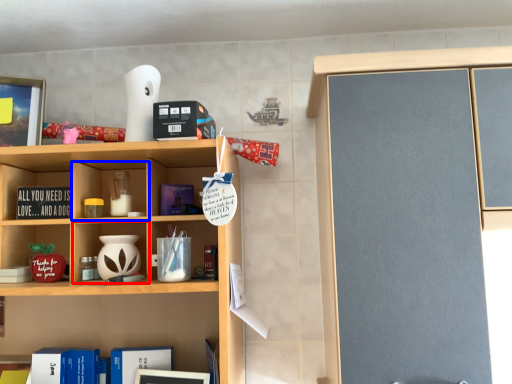
Question: Which object is further to the camera taking this photo, cabinet (highlighted by a red box) or cabinet (highlighted by a blue box)?

Choices:
 (A) cabinet
 (B) cabinet

Answer: (B)